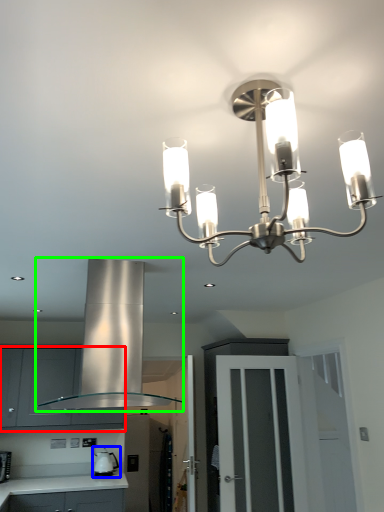
Question: Which is farther away from cabinetry (highlighted by a red box)? appliance (highlighted by a blue box) or exhaust hood (highlighted by a green box)?

Choices:
 (A) appliance
 (B) exhaust hood

Answer: (B)